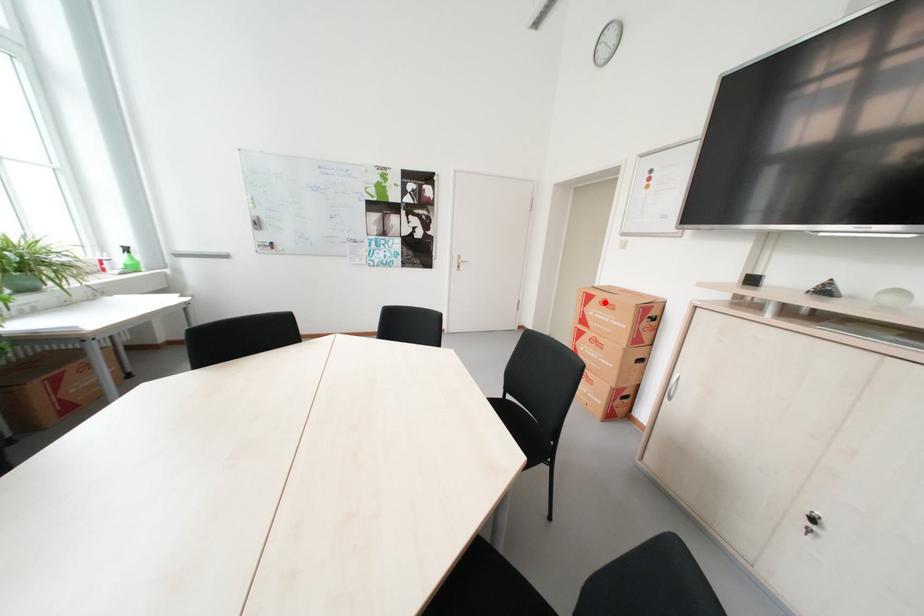
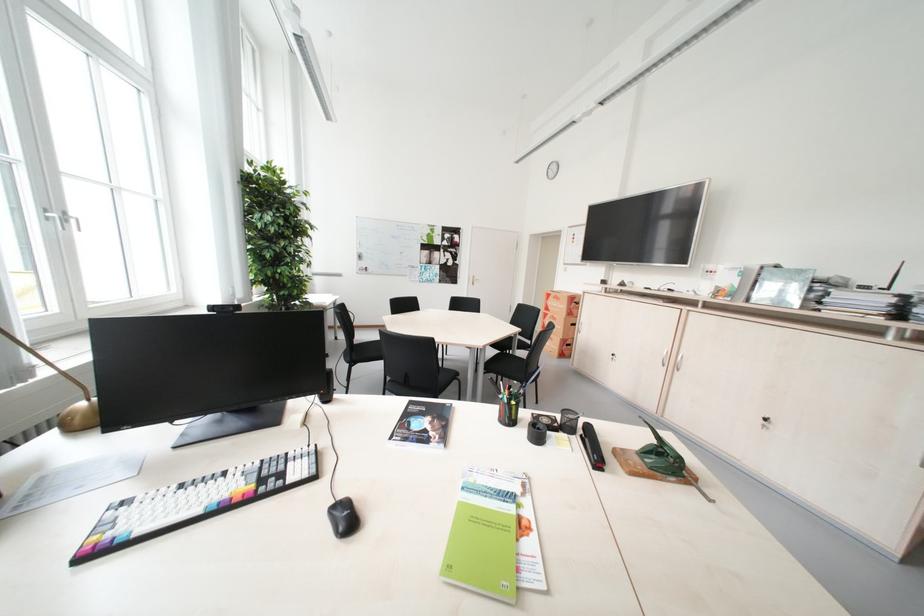
Question: I am providing you with two images of the same scene from different viewpoints. Image1 has a red point marked. In image2, the corresponding 3D location appears at what relative position? Reply with the corresponding letter.

Choices:
 (A) Closer
 (B) Farther

Answer: (A)